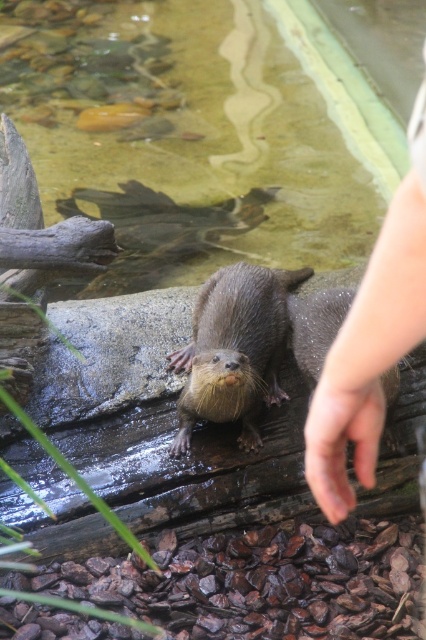
Can you confirm if skinny flesh at upper right is positioned to the right of skinny flesh at center?

In fact, skinny flesh at upper right is to the left of skinny flesh at center.

Does point (336, 480) lie behind point (322, 458)?

Yes, point (336, 480) is farther from viewer.

The height and width of the screenshot is (640, 426). I want to click on skinny flesh at upper right, so click(x=371, y=340).

Is brown furry otter at center below skinny flesh at center?

Actually, brown furry otter at center is above skinny flesh at center.

Is point (195, 330) positioned before point (357, 442)?

That is False.

Is point (275, 364) closer to camera compared to point (316, 499)?

No, (275, 364) is further to viewer.

Identify the location of brown furry otter at center. Image resolution: width=426 pixels, height=640 pixels. [235, 349].

Is skinny flesh at upper right below brown furry otter at center?

Indeed, skinny flesh at upper right is positioned under brown furry otter at center.

Is the position of skinny flesh at upper right more distant than that of brown furry otter at center?

No.

Locate an element on the screen. The width and height of the screenshot is (426, 640). skinny flesh at upper right is located at coordinates pyautogui.click(x=371, y=340).